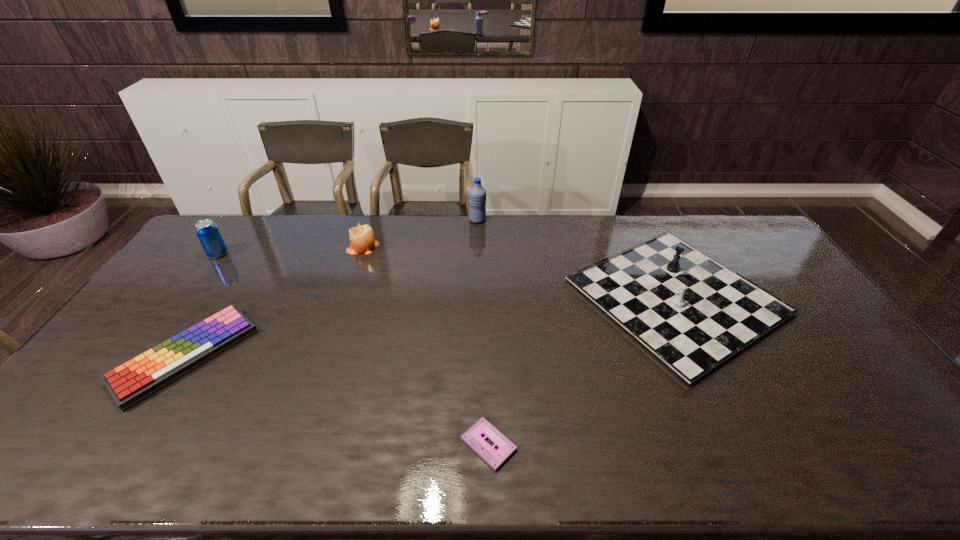
Image resolution: width=960 pixels, height=540 pixels. Find the location of `free space between the beer can and the second shortest object`. free space between the beer can and the second shortest object is located at coordinates (203, 305).

Where is `vacant space that is in between the candle and the videotape`? vacant space that is in between the candle and the videotape is located at coordinates (425, 346).

The height and width of the screenshot is (540, 960). Find the location of `blank region between the tallest object and the beer can`. blank region between the tallest object and the beer can is located at coordinates (348, 237).

Identify the location of free space between the candle and the beer can. (291, 251).

You are a GUI agent. You are given a task and a screenshot of the screen. Output one action in this format:
    pyautogui.click(x=<x>, y=<y>)
    Task: Click on the free point between the fifth tallest object and the tallest object
    The width and height of the screenshot is (960, 540).
    Given the screenshot: What is the action you would take?
    pyautogui.click(x=332, y=288)

The height and width of the screenshot is (540, 960). I want to click on empty space that is in between the farthest object and the rightmost object, so click(577, 258).

The image size is (960, 540). Find the location of `object that is the third closest to the second shortest object`. object that is the third closest to the second shortest object is located at coordinates (473, 437).

Select which object appears as the fifth closest to the fourth object from right to left. Please provide its 2D coordinates. Your answer should be formatted as a tuple, i.e. [(x, y)], where the tuple contains the x and y coordinates of a point satisfying the conditions above.

[(473, 437)]